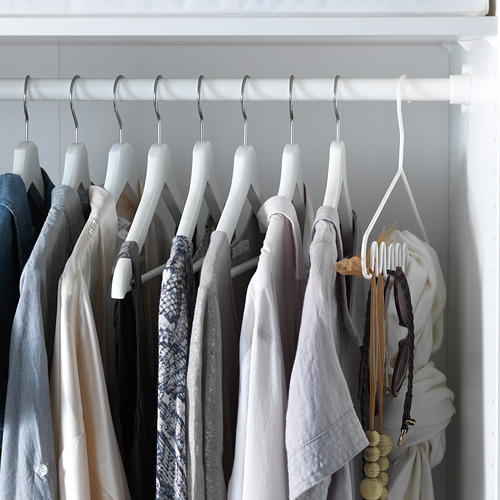
Where is `chrome plated hook for clothes hanger`? chrome plated hook for clothes hanger is located at coordinates (27, 117), (75, 120), (119, 119), (159, 117), (202, 113), (244, 114), (290, 116), (337, 116).